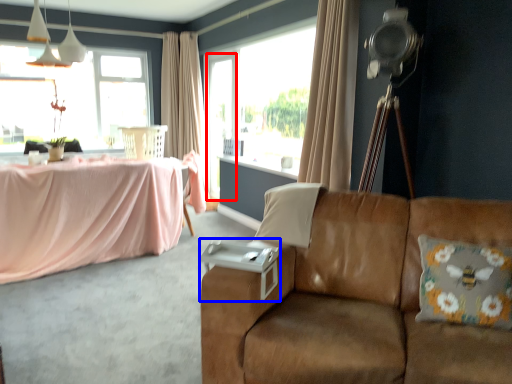
Question: Among these objects, which one is farthest to the camera, screen door (highlighted by a red box) or side table (highlighted by a blue box)?

Choices:
 (A) screen door
 (B) side table

Answer: (A)